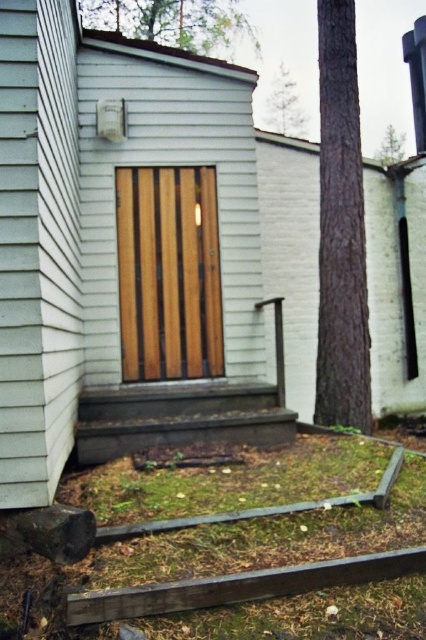
Question: Can you confirm if green leafy tree at upper center is bigger than green leafy tree at upper right?

Choices:
 (A) yes
 (B) no

Answer: (B)

Question: Can you confirm if brown rough bark tree at right is positioned to the right of green leafy tree at upper right?

Choices:
 (A) no
 (B) yes

Answer: (A)

Question: Can you confirm if wooden door at center is positioned above brown wooden stairs at lower center?

Choices:
 (A) yes
 (B) no

Answer: (A)

Question: Which point appears farthest from the camera in this image?

Choices:
 (A) (391, 129)
 (B) (317, 22)

Answer: (A)

Question: Which object appears farthest from the camera in this image?

Choices:
 (A) green leafy tree at upper center
 (B) wooden door at center
 (C) brown rough bark tree at right
 (D) green leafy tree at upper right

Answer: (D)

Question: Which point is closer to the camera taking this photo?

Choices:
 (A) (357, 298)
 (B) (385, 166)
 (C) (175, 35)

Answer: (A)